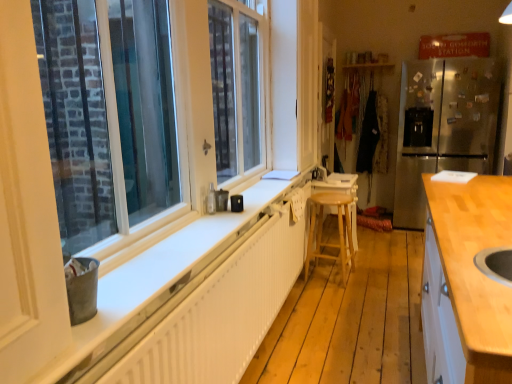
Question: From a real-world perspective, is light wood countertop at right on top of brushed metal faucet at center?

Choices:
 (A) no
 (B) yes

Answer: (A)

Question: Does light wood countertop at right come in front of brushed metal faucet at center?

Choices:
 (A) no
 (B) yes

Answer: (B)

Question: Is light wood countertop at right positioned behind brushed metal faucet at center?

Choices:
 (A) yes
 (B) no

Answer: (B)

Question: From a real-world perspective, is light wood countertop at right located beneath brushed metal faucet at center?

Choices:
 (A) no
 (B) yes

Answer: (B)

Question: Considering the relative sizes of light wood countertop at right and brushed metal faucet at center in the image provided, is light wood countertop at right thinner than brushed metal faucet at center?

Choices:
 (A) no
 (B) yes

Answer: (A)

Question: Is light brown wooden stool at center bigger or smaller than light wood countertop at right?

Choices:
 (A) big
 (B) small

Answer: (B)

Question: Considering the positions of light brown wooden stool at center and light wood countertop at right in the image, is light brown wooden stool at center taller or shorter than light wood countertop at right?

Choices:
 (A) tall
 (B) short

Answer: (B)

Question: Is light brown wooden stool at center to the left or to the right of light wood countertop at right in the image?

Choices:
 (A) right
 (B) left

Answer: (B)

Question: Considering the positions of point (307, 271) and point (424, 301), is point (307, 271) closer or farther from the camera than point (424, 301)?

Choices:
 (A) farther
 (B) closer

Answer: (A)

Question: Is white plastic window at left bigger or smaller than light wood countertop at right?

Choices:
 (A) small
 (B) big

Answer: (A)

Question: Considering the positions of white plastic window at left and light wood countertop at right in the image, is white plastic window at left taller or shorter than light wood countertop at right?

Choices:
 (A) tall
 (B) short

Answer: (A)

Question: Does point (99, 180) appear closer or farther from the camera than point (496, 279)?

Choices:
 (A) closer
 (B) farther

Answer: (B)

Question: Do you think white plastic window at left is within light wood countertop at right, or outside of it?

Choices:
 (A) inside
 (B) outside

Answer: (B)

Question: From a real-world perspective, is stainless steel refrigerator at right physically located above or below light brown wooden stool at center?

Choices:
 (A) below
 (B) above

Answer: (B)

Question: Is stainless steel refrigerator at right to the left or to the right of light brown wooden stool at center in the image?

Choices:
 (A) right
 (B) left

Answer: (A)